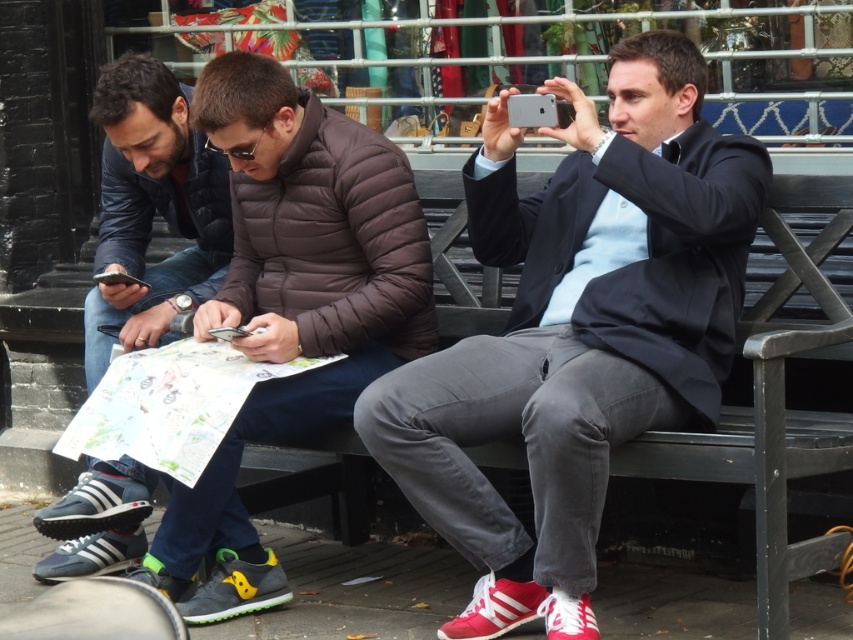
Where is `matte black jacket at center`? This screenshot has height=640, width=853. matte black jacket at center is located at coordinates (578, 330).

Describe the element at coordinates (578, 330) in the screenshot. This screenshot has height=640, width=853. I see `matte black jacket at center` at that location.

Does point (555, 339) come closer to viewer compared to point (407, 308)?

Yes, point (555, 339) is in front of point (407, 308).

At what (x,y) coordinates should I click in order to perform the action: click on matte black jacket at center. Please return your answer as a coordinate pair (x, y). This screenshot has height=640, width=853. Looking at the image, I should click on (578, 330).

Can you confirm if matte black jacket at center is positioned to the right of dark gray wood bench at center?

In fact, matte black jacket at center is to the left of dark gray wood bench at center.

Does matte black jacket at center appear over dark gray wood bench at center?

Actually, matte black jacket at center is below dark gray wood bench at center.

Where is `matte black jacket at center`? This screenshot has width=853, height=640. matte black jacket at center is located at coordinates (578, 330).

Identify the location of matte black jacket at center. [578, 330].

Consider the image. Can you confirm if dark gray wood bench at center is thinner than matte black jacket at left?

Indeed, dark gray wood bench at center has a lesser width compared to matte black jacket at left.

Which is behind, point (778, 221) or point (103, 504)?

Positioned behind is point (103, 504).

Identify the location of dark gray wood bench at center. This screenshot has height=640, width=853. (776, 384).